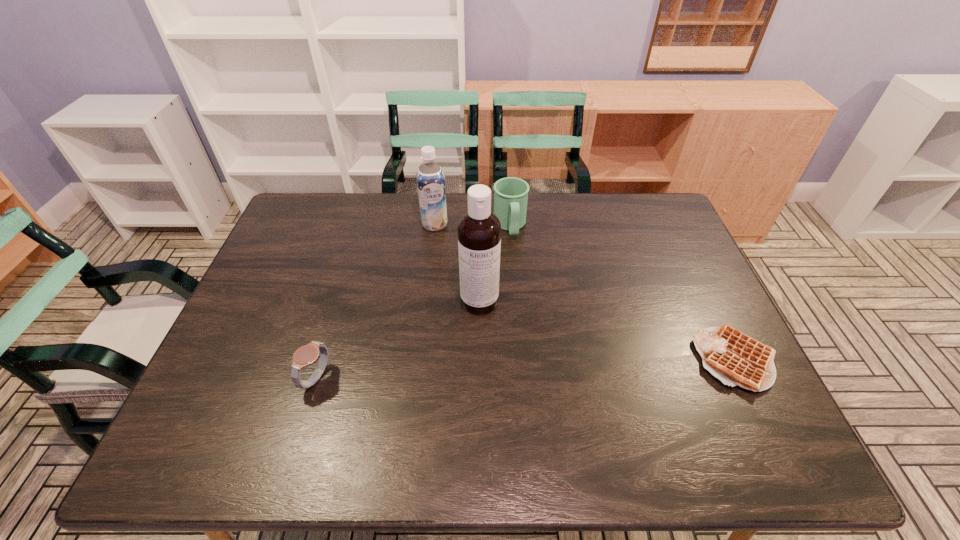
Where is `blank space located 0.050m on the front of the rightmost object`? blank space located 0.050m on the front of the rightmost object is located at coordinates (765, 416).

This screenshot has height=540, width=960. Identify the location of free space located on the side of the third shortest object with the handle. (519, 273).

You are a GUI agent. You are given a task and a screenshot of the screen. Output one action in this format:
    pyautogui.click(x=<x>, y=<y>)
    Task: Click on the vacant space located on the side of the third shortest object with the handle
    This screenshot has width=960, height=540.
    Given the screenshot: What is the action you would take?
    pyautogui.click(x=525, y=303)

Where is `free point located on the side of the third shortest object with the handle`? The height and width of the screenshot is (540, 960). free point located on the side of the third shortest object with the handle is located at coordinates coord(522,291).

Where is `blank space located on the label side of the tallest object`? blank space located on the label side of the tallest object is located at coordinates (503, 417).

The image size is (960, 540). I want to click on free region located on the label side of the tallest object, so click(488, 342).

The image size is (960, 540). What are the coordinates of `vacant area located on the label side of the tallest object` in the screenshot? It's located at (486, 333).

Locate an element on the screen. This screenshot has height=540, width=960. vacant space located on the label of the second tallest object is located at coordinates (444, 265).

In order to click on blank space located on the label of the second tallest object in this screenshot , I will do `click(457, 316)`.

What are the coordinates of `free space located on the label of the second tallest object` in the screenshot? It's located at (451, 291).